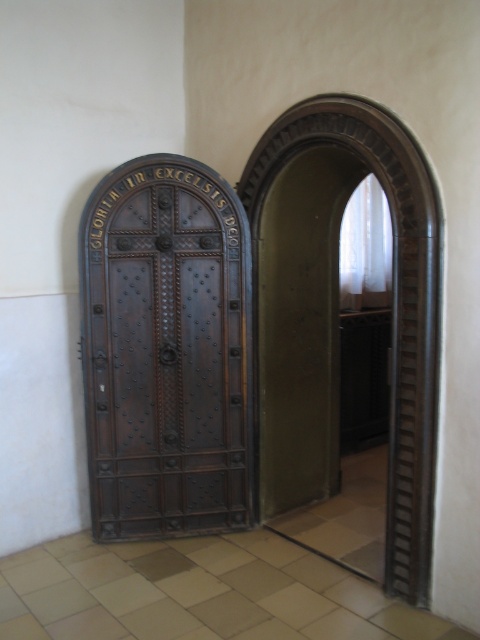
Does dark wood/embossed door at center have a lesser height compared to dark wood archway at center?

Yes, dark wood/embossed door at center is shorter than dark wood archway at center.

From the picture: Which is above, dark wood/embossed door at center or dark wood archway at center?

dark wood archway at center is above.

This screenshot has height=640, width=480. Describe the element at coordinates (166, 349) in the screenshot. I see `dark wood/embossed door at center` at that location.

Locate an element on the screen. The image size is (480, 640). dark wood/embossed door at center is located at coordinates (166, 349).